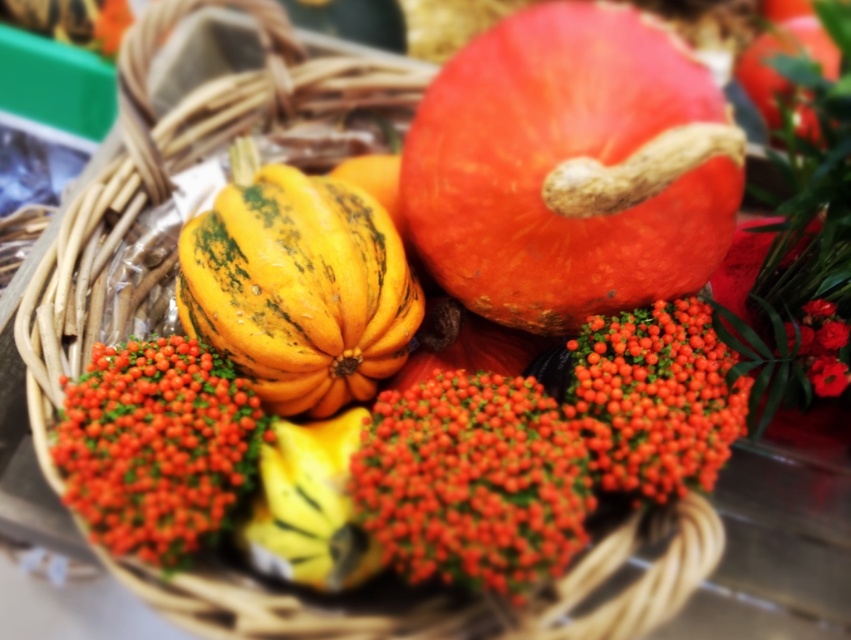
What are the coordinates of `yellow-green textured squash at center` in the screenshot? It's located at (298, 285).

Is point (236, 228) positioned before point (295, 512)?

No, (236, 228) is behind (295, 512).

Is point (326, 305) positioned before point (327, 518)?

That is False.

Find the location of `yellow-green textured squash at center`. yellow-green textured squash at center is located at coordinates (298, 285).

Is point (698, 182) closer to camera compared to point (136, 547)?

No, (698, 182) is further to viewer.

Who is taller, orange matte pumpkin at upper center or shiny orange berries at center?

orange matte pumpkin at upper center is taller.

Is point (504, 58) positioned in front of point (124, 470)?

No.

Where is `orange matte pumpkin at upper center`? This screenshot has height=640, width=851. orange matte pumpkin at upper center is located at coordinates (570, 168).

Between yellow-green textured squash at center and smooth red flower at upper right, which one is positioned higher?

Positioned higher is yellow-green textured squash at center.

Does yellow-green textured squash at center have a greater height compared to smooth red flower at upper right?

Indeed, yellow-green textured squash at center has a greater height compared to smooth red flower at upper right.

I want to click on yellow-green textured squash at center, so click(298, 285).

Find the location of a particular element. yellow-green textured squash at center is located at coordinates (298, 285).